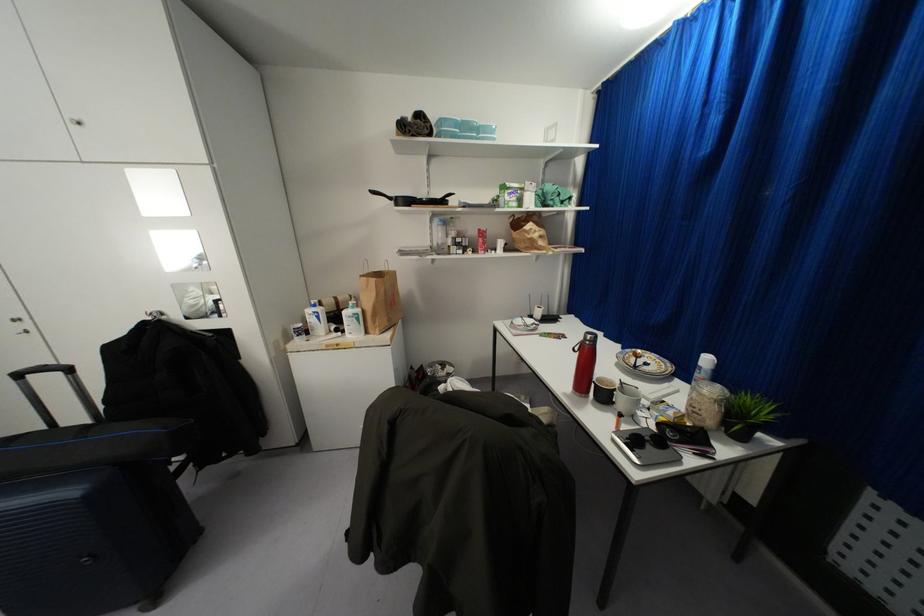
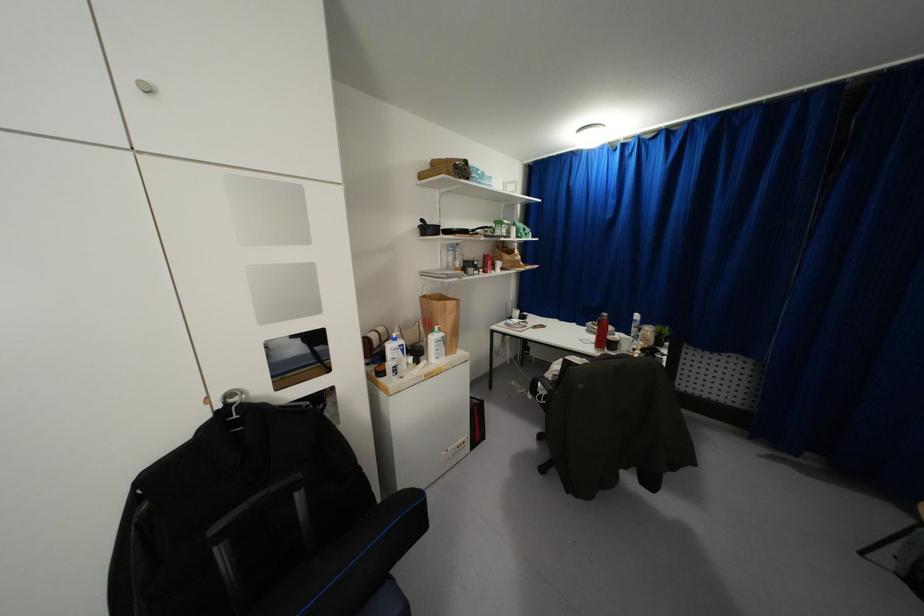
The point at [317,315] is marked in the first image. Where is the corresponding point in the second image?

(402, 350)